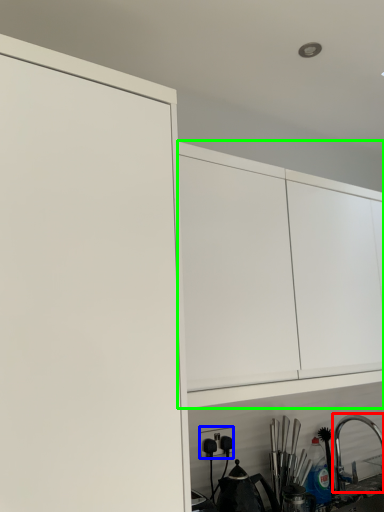
Question: Considering the real-world distances, which object is closest to tap (highlighted by a red box)? electric outlet (highlighted by a blue box) or cabinetry (highlighted by a green box).

Choices:
 (A) electric outlet
 (B) cabinetry

Answer: (A)